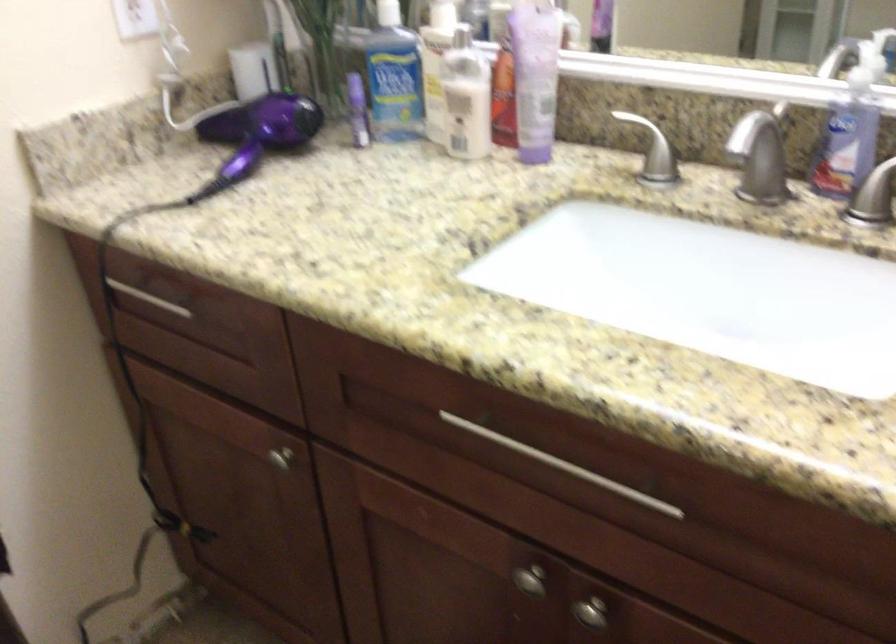
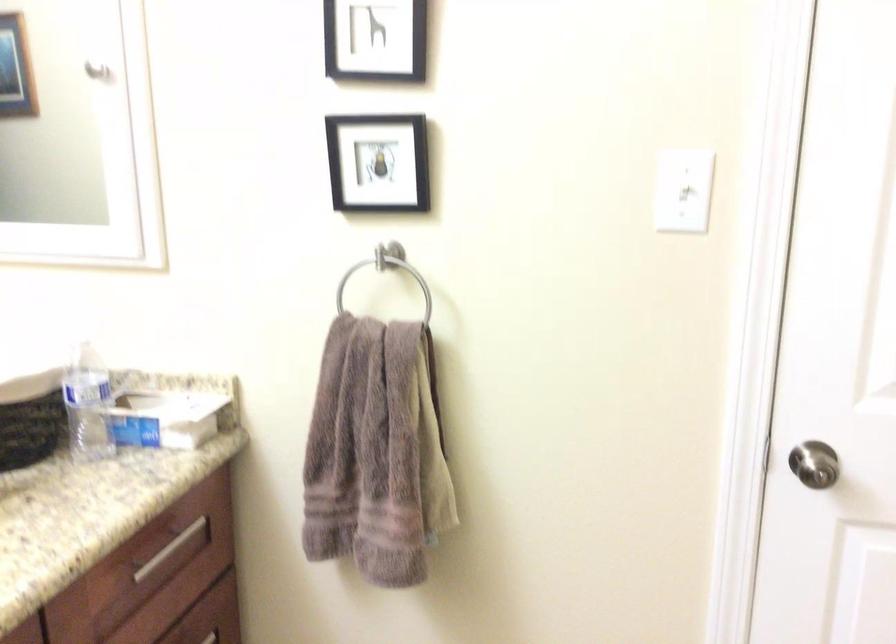
How did the camera likely rotate?

The camera's rotation is toward right-down.